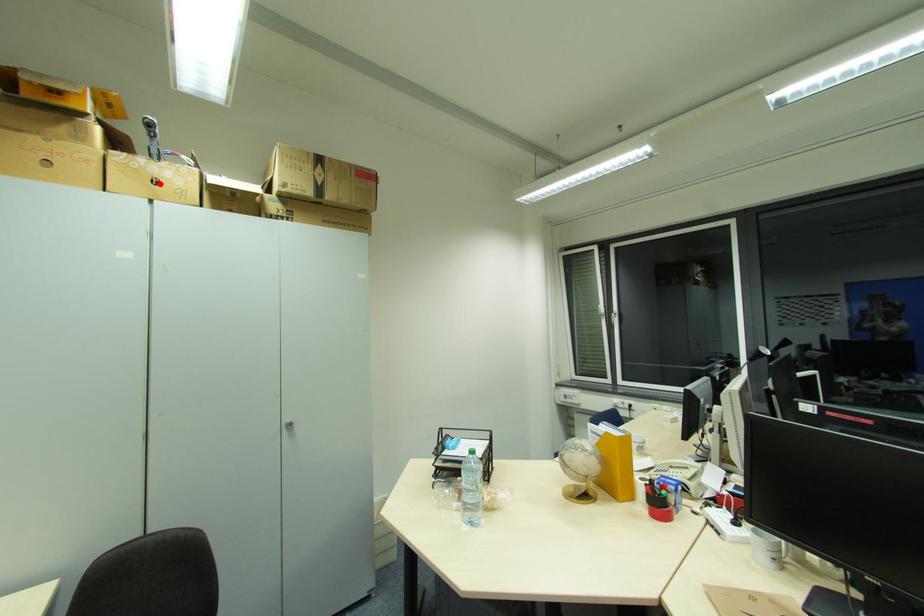
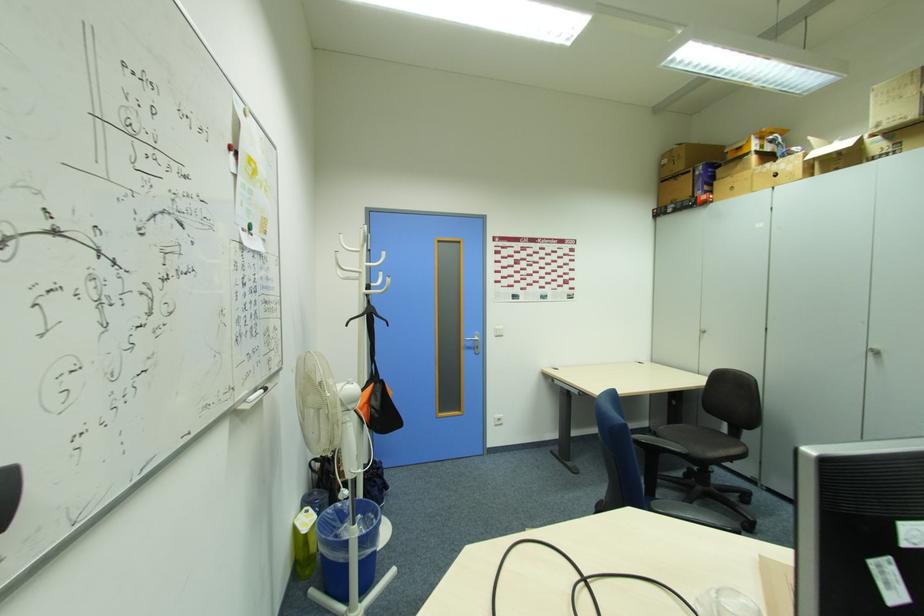
Locate, in the second image, the point that corresponds to the highlighted location in the first image.

(779, 176)